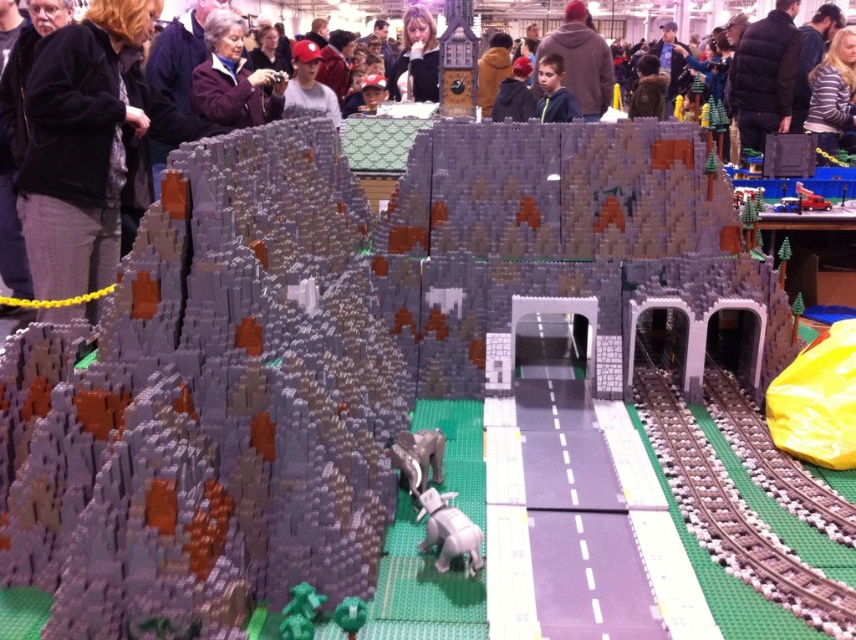
Which is behind, point (206, 61) or point (283, 611)?

Positioned behind is point (206, 61).

Who is lower down, matte purple jacket at upper left or green matte tree at lower left?

green matte tree at lower left is lower down.

Is point (210, 106) behind point (308, 596)?

Yes, it is.

This screenshot has width=856, height=640. Find the location of `matte purple jacket at upper left`. matte purple jacket at upper left is located at coordinates (233, 77).

Which is below, matte purple jacket at upper left or green matte tree at lower center?

green matte tree at lower center is lower down.

Is point (265, 93) closer to camera compared to point (342, 621)?

No, (265, 93) is behind (342, 621).

Identify the location of matte purple jacket at upper left. The width and height of the screenshot is (856, 640). (233, 77).

Between striped sweater at upper right and blue shirt at upper center, which one has more height?

striped sweater at upper right

Between point (831, 86) and point (574, 109), which one is positioned in front?

Point (574, 109)

Identify the location of striped sweater at upper right. (831, 92).

I want to click on striped sweater at upper right, so click(831, 92).